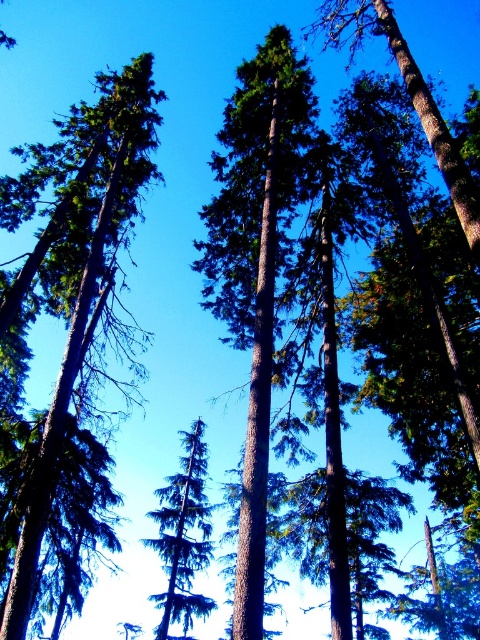
You are a bird looking for a nesting spot. You see the green textured tree at center and the green rough bark tree at center. Which tree would provide a larger area for nesting?

The green textured tree at center is larger in size than the green rough bark tree at center, so it would provide a larger area for nesting.